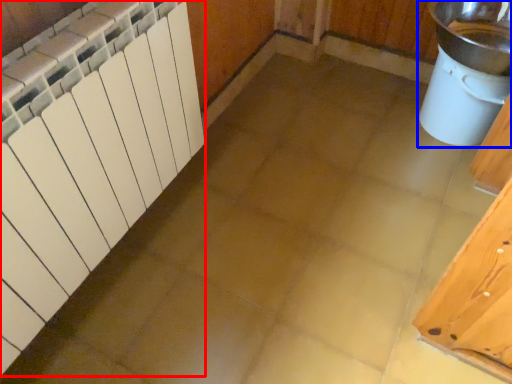
Question: Which of the following is the farthest to the observer, radiator (highlighted by a red box) or sink (highlighted by a blue box)?

Choices:
 (A) radiator
 (B) sink

Answer: (B)